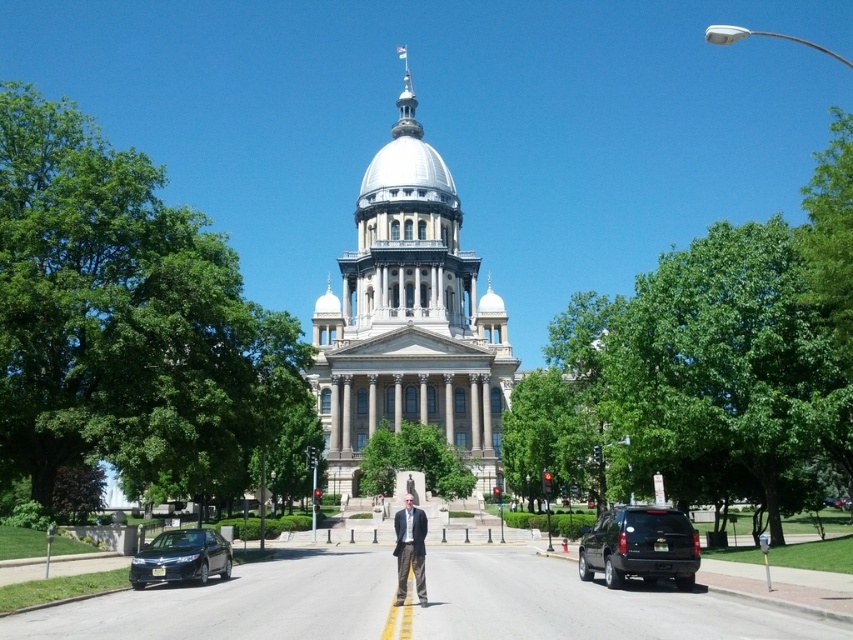
Question: Where is black matte suv at lower right located in relation to light brown textured pants at center in the image?

Choices:
 (A) below
 (B) above

Answer: (A)

Question: Which point is farther to the camera?

Choices:
 (A) (415, 541)
 (B) (231, 564)

Answer: (B)

Question: Which object appears farthest from the camera in this image?

Choices:
 (A) shiny black sedan at lower left
 (B) black matte suv at lower right
 (C) light brown textured pants at center

Answer: (A)

Question: Which point is farther from the camera taking this photo?

Choices:
 (A) (422, 531)
 (B) (614, 541)

Answer: (B)

Question: Does shiny black sedan at lower left appear on the right side of light brown textured pants at center?

Choices:
 (A) no
 (B) yes

Answer: (A)

Question: Is black matte suv at lower right positioned behind light brown textured pants at center?

Choices:
 (A) yes
 (B) no

Answer: (A)